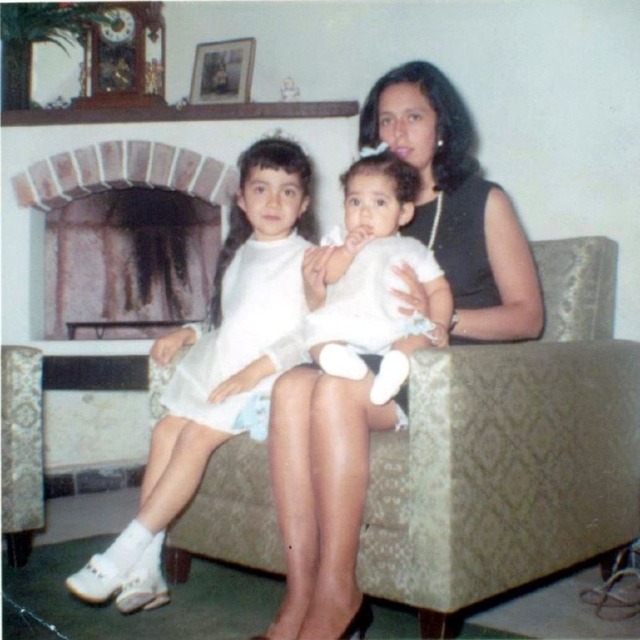
Question: Which object appears closest to the camera in this image?

Choices:
 (A) white matte dress at center
 (B) green textured couch at center

Answer: (B)

Question: From the image, what is the correct spatial relationship of white matte dress at center in relation to brick fireplace at upper left?

Choices:
 (A) below
 (B) above

Answer: (A)

Question: Is the position of green textured couch at center more distant than that of white soft baby at center?

Choices:
 (A) no
 (B) yes

Answer: (A)

Question: Estimate the real-world distances between objects in this image. Which object is closer to the white matte dress at center?

Choices:
 (A) green textured couch at center
 (B) white soft baby at center

Answer: (B)

Question: Is white matte dress at center wider than brick fireplace at upper left?

Choices:
 (A) no
 (B) yes

Answer: (A)

Question: Which point is farther from the camera taking this photo?

Choices:
 (A) (378, 337)
 (B) (300, 147)

Answer: (B)